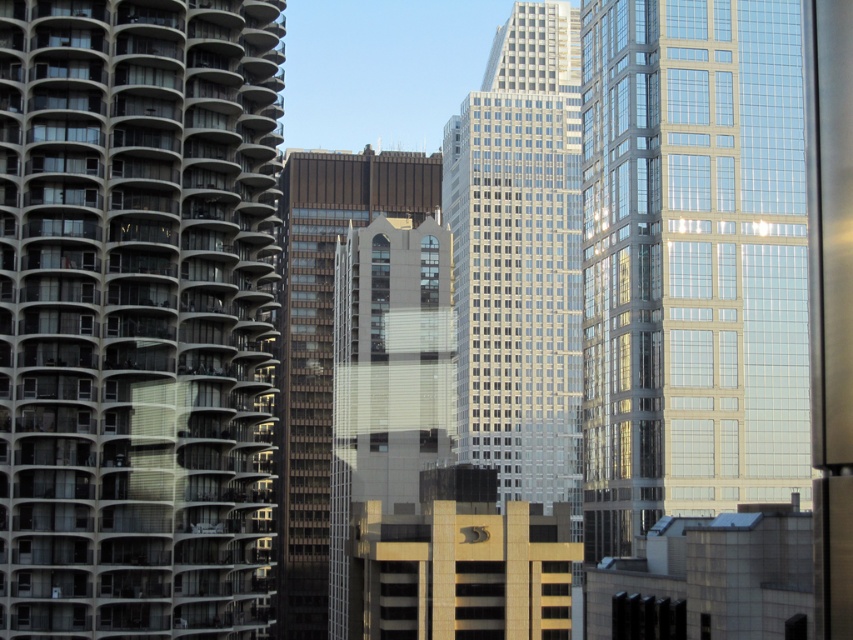
Question: Based on their relative distances, which object is farther from the white concrete building at left?

Choices:
 (A) brown glassy building at center
 (B) clear glass skyscraper at right

Answer: (A)

Question: Can you confirm if glassy silver skyscraper at center is positioned to the right of brown glassy building at center?

Choices:
 (A) no
 (B) yes

Answer: (B)

Question: Where is white concrete building at left located in relation to glassy silver skyscraper at center in the image?

Choices:
 (A) left
 (B) right

Answer: (A)

Question: Which point is closer to the camera?

Choices:
 (A) white concrete building at left
 (B) glassy silver skyscraper at center

Answer: (A)

Question: Which of these objects is positioned farthest from the white concrete building at left?

Choices:
 (A) glassy silver skyscraper at center
 (B) brown glassy building at center
 (C) clear glass skyscraper at right

Answer: (B)

Question: Does white concrete building at left appear over glassy silver skyscraper at center?

Choices:
 (A) yes
 (B) no

Answer: (B)